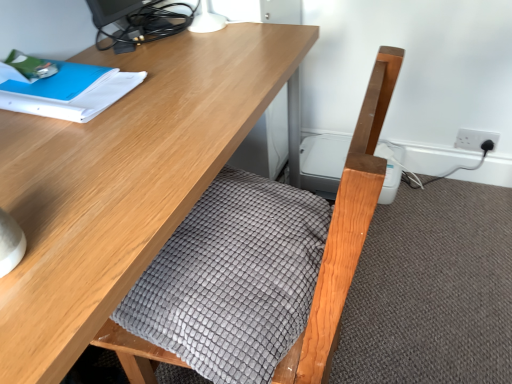
Locate an element on the screen. This screenshot has height=384, width=512. unoccupied area in front of matte black monitor at upper left is located at coordinates (180, 71).